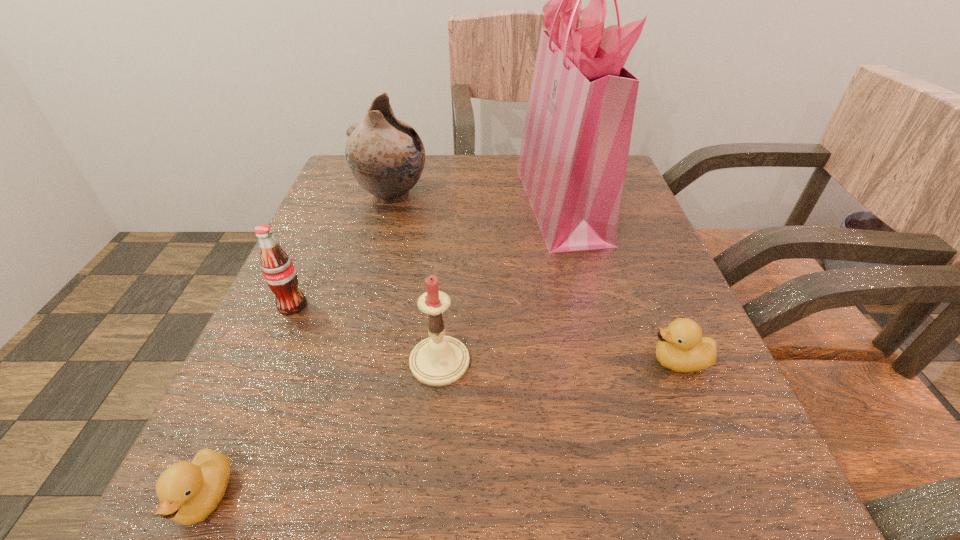
At what (x,y) coordinates should I click in order to perform the action: click on vacant space located on the left of the candle. Please return your answer as a coordinate pair (x, y). This screenshot has width=960, height=540. Looking at the image, I should click on (353, 361).

The width and height of the screenshot is (960, 540). What are the coordinates of `vacant space situated on the back of the fourth nearest object` in the screenshot? It's located at tap(348, 179).

The width and height of the screenshot is (960, 540). Find the location of `free spot located 0.380m on the face of the right duckling`. free spot located 0.380m on the face of the right duckling is located at coordinates (378, 361).

You are a GUI agent. You are given a task and a screenshot of the screen. Output one action in this format:
    pyautogui.click(x=<x>, y=<y>)
    Task: Click on the vacant space located 0.250m on the face of the right duckling
    
    Given the screenshot: What is the action you would take?
    pyautogui.click(x=470, y=361)

Where is `free space located 0.310m on the face of the right duckling`? Image resolution: width=960 pixels, height=540 pixels. free space located 0.310m on the face of the right duckling is located at coordinates (428, 361).

Where is `shopping bag that is at the far edge`? shopping bag that is at the far edge is located at coordinates (573, 158).

I want to click on pottery present at the far edge, so click(x=385, y=155).

Where is `object situated at the near edge`? This screenshot has width=960, height=540. object situated at the near edge is located at coordinates (188, 492).

Where is `pottery present at the left edge`? pottery present at the left edge is located at coordinates (385, 155).

Image resolution: width=960 pixels, height=540 pixels. What are the coordinates of `soda situated at the left edge` in the screenshot? It's located at click(278, 270).